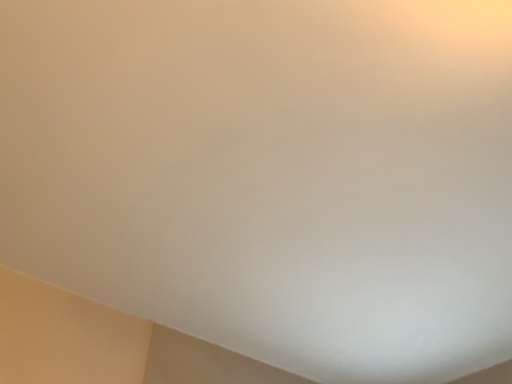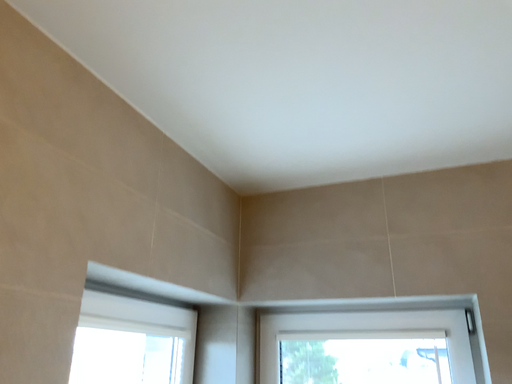
Question: How did the camera likely rotate when shooting the video?

Choices:
 (A) rotated left
 (B) rotated right

Answer: (B)